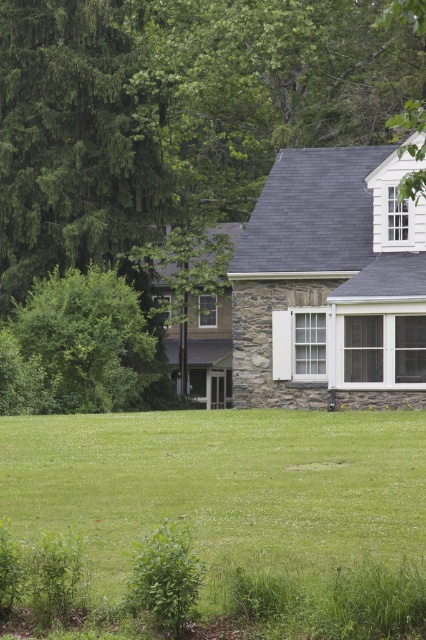
Question: Is green grass at center thinner than green leafy bush at left?

Choices:
 (A) yes
 (B) no

Answer: (B)

Question: Can you confirm if green leafy tree at upper left is positioned to the left of green grass at center?

Choices:
 (A) yes
 (B) no

Answer: (A)

Question: Does green leafy tree at upper left come in front of green grass at center?

Choices:
 (A) no
 (B) yes

Answer: (A)

Question: Based on their relative distances, which object is farther from the green grass at center?

Choices:
 (A) green leafy tree at upper left
 (B) green leafy bush at left

Answer: (A)

Question: Which object appears closest to the camera in this image?

Choices:
 (A) green leafy tree at upper left
 (B) green leafy bush at left

Answer: (A)

Question: Which point appears farthest from the camera in this image?

Choices:
 (A) (78, 406)
 (B) (112, 17)
 (C) (120, 545)

Answer: (B)